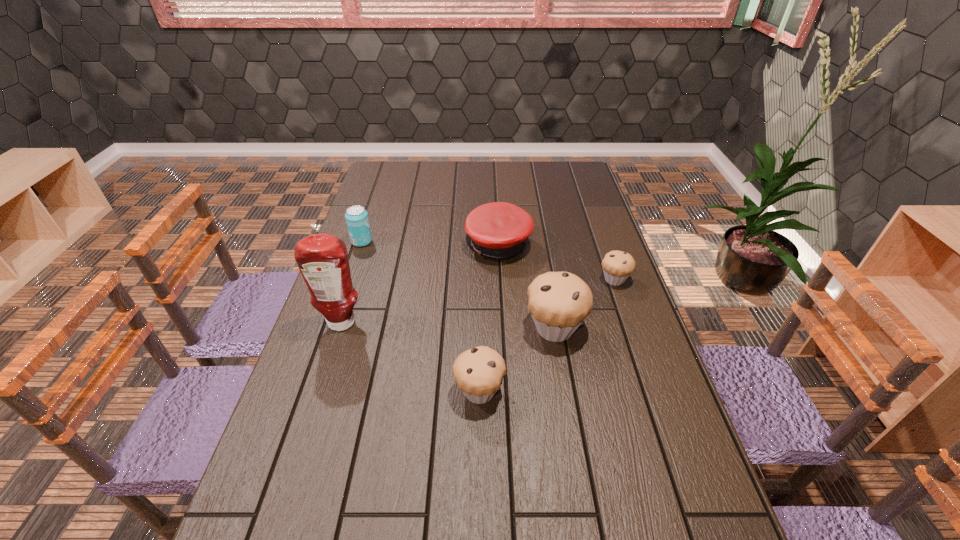
Identify the location of vacant space that satisfies the following two spatial constraints: 1. on the back side of the rightmost muffin; 2. on the left side of the nearest object. (479, 280).